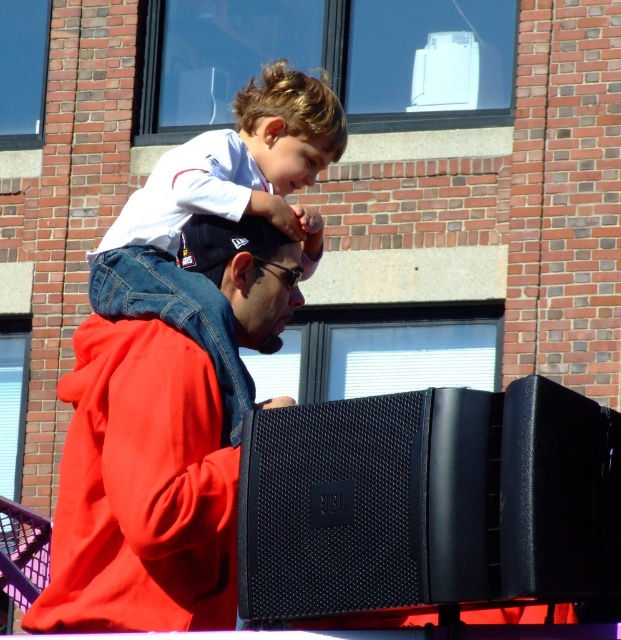
Question: Which point is closer to the camera?

Choices:
 (A) (x=424, y=424)
 (B) (x=89, y=515)
 (C) (x=319, y=244)

Answer: (A)

Question: Which of the following is the farthest from the observer?

Choices:
 (A) (168, 627)
 (B) (599, 576)
 (C) (211, 186)

Answer: (C)

Question: Is black mesh speaker at lower right above white matte shirt at upper center?

Choices:
 (A) yes
 (B) no

Answer: (B)

Question: Which point appears farthest from the camera in this image?

Choices:
 (A) (366, 435)
 (B) (127, 348)
 (C) (201, 164)

Answer: (C)

Question: Is black mesh speaker at lower right positioned before matte red hoodie at center?

Choices:
 (A) yes
 (B) no

Answer: (A)

Question: Is black mesh speaker at lower right smaller than matte red hoodie at center?

Choices:
 (A) yes
 (B) no

Answer: (A)